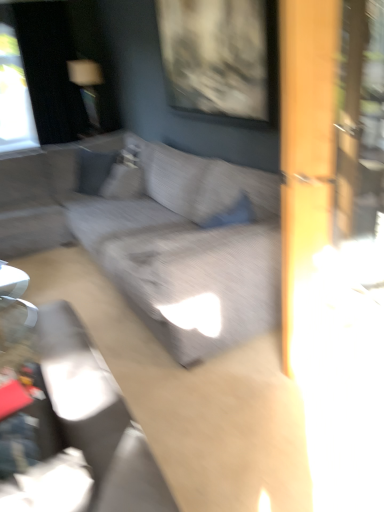
Question: Does suede-like gray pillow at upper left have a greater width compared to textured gray couch at center?

Choices:
 (A) no
 (B) yes

Answer: (A)

Question: Is textured gray couch at center inside suede-like gray pillow at upper left?

Choices:
 (A) yes
 (B) no

Answer: (B)

Question: Would you say suede-like gray pillow at upper left is outside textured gray couch at center?

Choices:
 (A) no
 (B) yes

Answer: (B)

Question: From the image's perspective, does suede-like gray pillow at upper left appear higher than textured gray couch at center?

Choices:
 (A) no
 (B) yes

Answer: (B)

Question: Does suede-like gray pillow at upper left have a larger size compared to textured gray couch at center?

Choices:
 (A) yes
 (B) no

Answer: (B)

Question: Is matte gray swivel chair at center in front of or behind suede-like gray pillow at upper left in the image?

Choices:
 (A) front
 (B) behind

Answer: (A)

Question: Does point (130, 477) appear closer or farther from the camera than point (115, 181)?

Choices:
 (A) closer
 (B) farther

Answer: (A)

Question: Is matte gray swivel chair at center situated inside suede-like gray pillow at upper left or outside?

Choices:
 (A) outside
 (B) inside

Answer: (A)

Question: Is matte gray swivel chair at center bigger or smaller than suede-like gray pillow at upper left?

Choices:
 (A) small
 (B) big

Answer: (B)

Question: Does point (66, 334) appear closer or farther from the camera than point (44, 183)?

Choices:
 (A) farther
 (B) closer

Answer: (B)

Question: In the image, is matte gray swivel chair at center positioned in front of or behind textured gray couch at center?

Choices:
 (A) behind
 (B) front

Answer: (B)

Question: From the image's perspective, is matte gray swivel chair at center above or below textured gray couch at center?

Choices:
 (A) above
 (B) below

Answer: (B)

Question: Is matte gray swivel chair at center spatially inside textured gray couch at center, or outside of it?

Choices:
 (A) inside
 (B) outside

Answer: (B)

Question: Is point (140, 187) closer or farther from the camera than point (180, 334)?

Choices:
 (A) farther
 (B) closer

Answer: (A)

Question: Considering the positions of suede-like gray pillow at upper left and textured gray couch at center in the image, is suede-like gray pillow at upper left taller or shorter than textured gray couch at center?

Choices:
 (A) short
 (B) tall

Answer: (A)